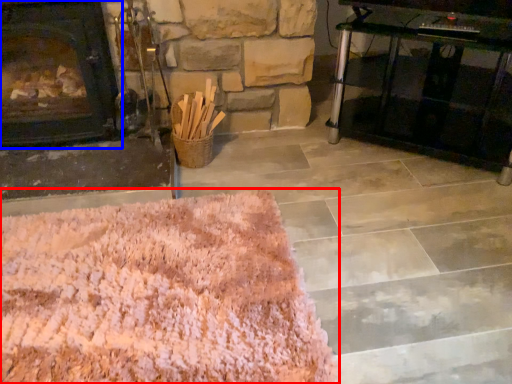
Question: Which of the following is the farthest to the observer, mat (highlighted by a red box) or fireplace (highlighted by a blue box)?

Choices:
 (A) mat
 (B) fireplace

Answer: (B)